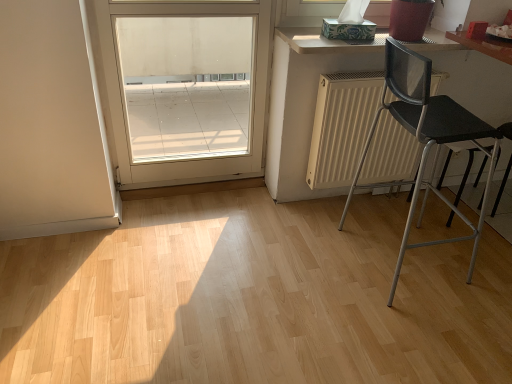
Question: In the image, is black mesh chair at right on the left side or the right side of white matte radiator at center?

Choices:
 (A) right
 (B) left

Answer: (A)

Question: From the image's perspective, relative to white matte radiator at center, is black mesh chair at right above or below?

Choices:
 (A) below
 (B) above

Answer: (A)

Question: Estimate the real-world distances between objects in this image. Which object is farther from the light wood countertop at upper right?

Choices:
 (A) white matte radiator at center
 (B) white glossy door at upper left
 (C) black mesh chair at right

Answer: (B)

Question: Which object is the closest to the black mesh chair at right?

Choices:
 (A) white glossy door at upper left
 (B) light wood countertop at upper right
 (C) white matte radiator at center

Answer: (C)